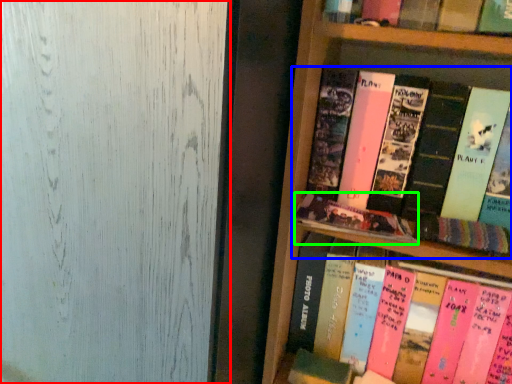
Question: Which is farther away from glass door (highlighted by a red box)? book (highlighted by a blue box) or book (highlighted by a green box)?

Choices:
 (A) book
 (B) book

Answer: (A)